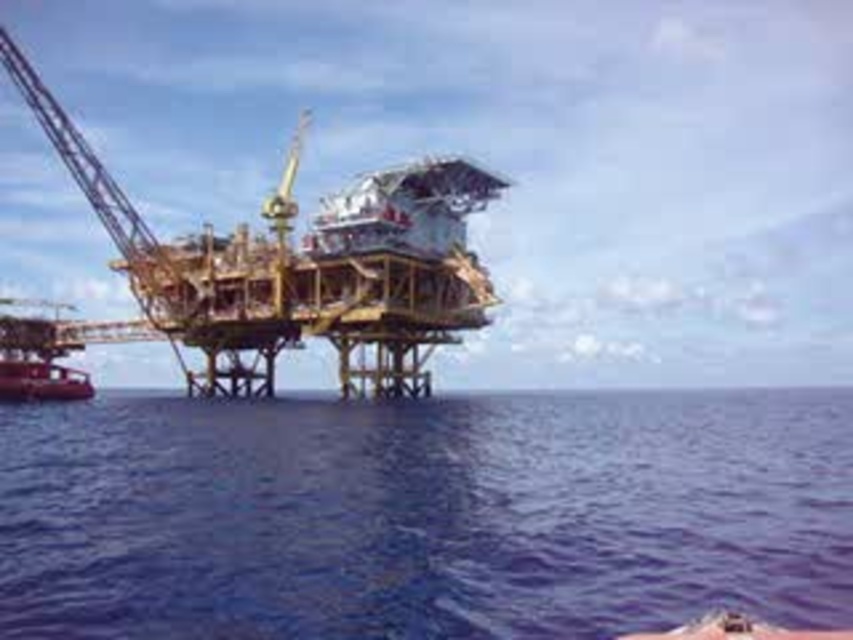
You are a technician on the offshore oil rig and need to determine the distance between two points for a safety inspection. The points are labeled as point 1 at coordinate point (492, 538) and point 2 at coordinate point (10, 371). Since you can only measure distances from your current position near the crane arm, which point should you measure first to ensure accurate readings?

Point 1 at coordinate point (492, 538) should be measured first because it is closer to the camera, allowing for more accurate measurements before moving to the farther point 2 at coordinate point (10, 371).

You are a crane operator on the offshore oil rig. You need to lower a heavy equipment into the blue water at center. The metallic red boat at lower left is anchored nearby. Can you safely lower the equipment into the water without hitting the boat?

The blue water at center is shorter than the metallic red boat at lower left, meaning the boat is closer to the water surface. Lowering the equipment might risk collision with the boat. Ensure the boat moves to a safe distance before proceeding.